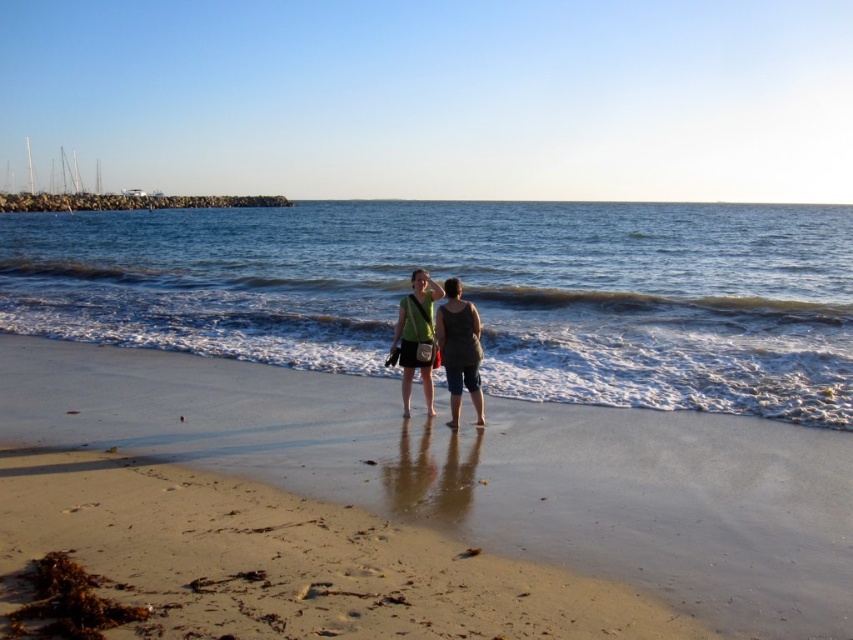
You are standing on the beach and see two points marked in the scene. Which point is closer to you, point (810, 356) or point (421, 314)?

Point (810, 356) is closer to you because it is further to the viewer than point (421, 314).

You are a photographer wanting to capture the clear blue water at center and the matte gray tank top at center in the same frame. Which object should you focus on to ensure both are in the shot without moving the camera?

The clear blue water at center has a greater width than the matte gray tank top at center, so focusing on the center of the frame where both overlap would ensure both are captured.